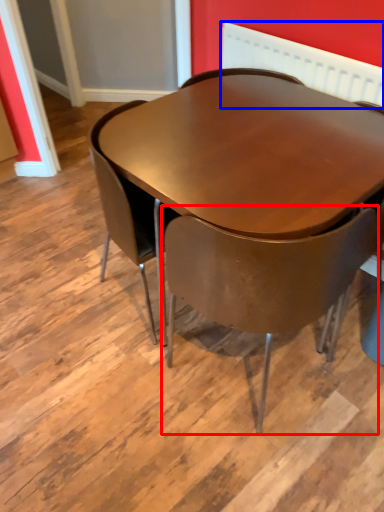
Question: Which point is further to the camera, chair (highlighted by a red box) or radiator (highlighted by a blue box)?

Choices:
 (A) chair
 (B) radiator

Answer: (B)